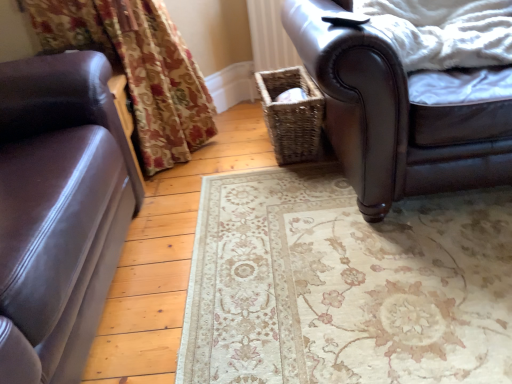
Question: From a real-world perspective, is brown leather chair at upper right on woven brown basket at center?

Choices:
 (A) yes
 (B) no

Answer: (A)

Question: Is brown leather chair at upper right not near woven brown basket at center?

Choices:
 (A) yes
 (B) no

Answer: (B)

Question: Is brown leather chair at upper right not within woven brown basket at center?

Choices:
 (A) no
 (B) yes

Answer: (B)

Question: Is the position of brown leather chair at upper right less distant than that of woven brown basket at center?

Choices:
 (A) no
 (B) yes

Answer: (B)

Question: Does brown leather chair at upper right have a smaller size compared to woven brown basket at center?

Choices:
 (A) yes
 (B) no

Answer: (B)

Question: Does point (396, 165) appear closer or farther from the camera than point (455, 51)?

Choices:
 (A) closer
 (B) farther

Answer: (A)

Question: In terms of size, does brown leather chair at upper right appear bigger or smaller than white fluffy blanket at upper right?

Choices:
 (A) big
 (B) small

Answer: (A)

Question: In terms of width, does brown leather chair at upper right look wider or thinner when compared to white fluffy blanket at upper right?

Choices:
 (A) wide
 (B) thin

Answer: (A)

Question: Do you think brown leather chair at upper right is within white fluffy blanket at upper right, or outside of it?

Choices:
 (A) outside
 (B) inside

Answer: (A)

Question: Considering the relative positions of woven brown basket at center and brown leather chair at upper right in the image provided, is woven brown basket at center to the left or to the right of brown leather chair at upper right?

Choices:
 (A) left
 (B) right

Answer: (A)

Question: Based on their sizes in the image, would you say woven brown basket at center is bigger or smaller than brown leather chair at upper right?

Choices:
 (A) big
 (B) small

Answer: (B)

Question: Relative to brown leather chair at upper right, is woven brown basket at center in front or behind?

Choices:
 (A) behind
 (B) front

Answer: (A)

Question: Looking at their shapes, would you say woven brown basket at center is wider or thinner than brown leather chair at upper right?

Choices:
 (A) thin
 (B) wide

Answer: (A)

Question: Is white fluffy blanket at upper right taller or shorter than brown leather chair at upper right?

Choices:
 (A) short
 (B) tall

Answer: (A)

Question: Visually, is white fluffy blanket at upper right positioned to the left or to the right of brown leather chair at upper right?

Choices:
 (A) right
 (B) left

Answer: (A)